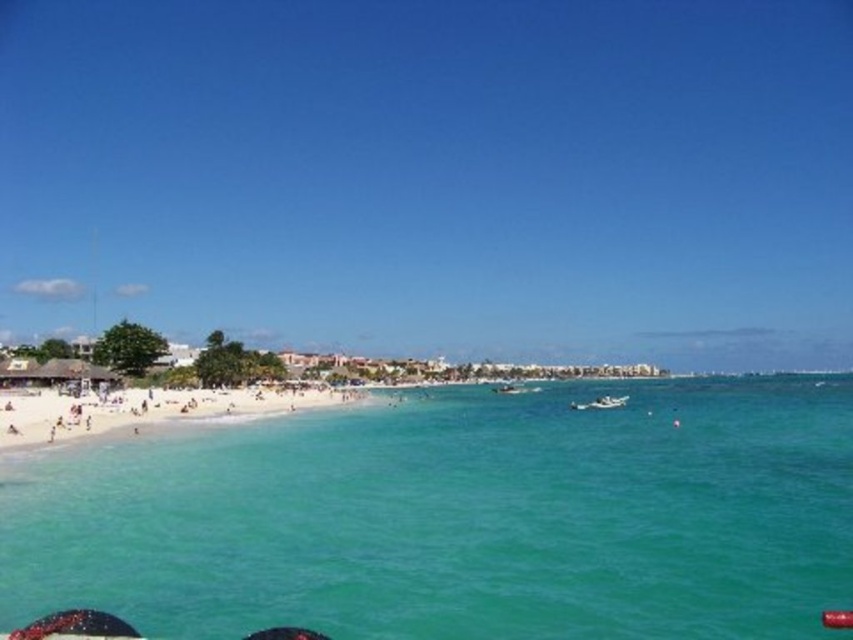
Does white sand beach at lower left lie in front of white glossy boat at lower center?

Yes, white sand beach at lower left is in front of white glossy boat at lower center.

Identify the location of white sand beach at lower left. (148, 410).

Identify the location of white sand beach at lower left. The width and height of the screenshot is (853, 640). point(148,410).

In the scene shown: Measure the distance between point [779,621] and camera.

Point [779,621] and camera are 91.35 feet apart.

Locate an element on the screen. The width and height of the screenshot is (853, 640). clear blue water at beach center is located at coordinates (457, 516).

Can you confirm if clear blue water at beach center is positioned to the right of white sand beach at lower left?

Correct, you'll find clear blue water at beach center to the right of white sand beach at lower left.

Which of these two, clear blue water at beach center or white sand beach at lower left, stands taller?

With more height is clear blue water at beach center.

Is point (309, 476) positioned before point (292, 390)?

Yes.

Locate an element on the screen. The width and height of the screenshot is (853, 640). clear blue water at beach center is located at coordinates (457, 516).